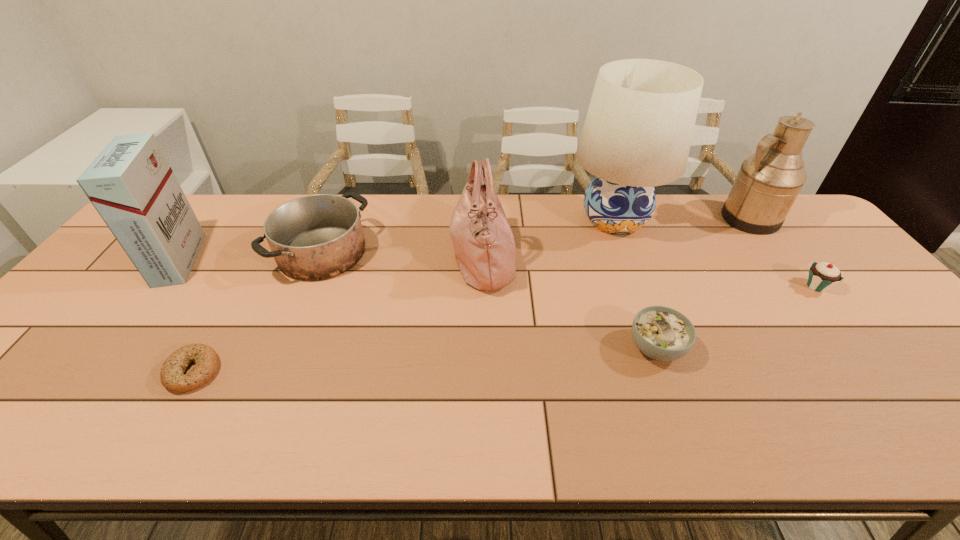
The width and height of the screenshot is (960, 540). I want to click on vacant space at the left edge of the desktop, so click(99, 304).

Where is `vacant space at the right edge of the desktop`? Image resolution: width=960 pixels, height=540 pixels. vacant space at the right edge of the desktop is located at coordinates (901, 340).

The image size is (960, 540). I want to click on free point between the pitcher and the soup bowl, so click(x=703, y=283).

Where is `empty space that is in between the fourth shortest object and the cupcake`? Image resolution: width=960 pixels, height=540 pixels. empty space that is in between the fourth shortest object and the cupcake is located at coordinates tap(569, 269).

At what (x,y) coordinates should I click in order to perform the action: click on unoccupied area between the shortest object and the pitcher. Please return your answer as a coordinate pair (x, y). The height and width of the screenshot is (540, 960). Looking at the image, I should click on (471, 295).

Image resolution: width=960 pixels, height=540 pixels. Identify the location of empty location between the cupcake and the pitcher. (782, 252).

Where is `vacant area that lies between the soup bowl and the leftmost object`? Image resolution: width=960 pixels, height=540 pixels. vacant area that lies between the soup bowl and the leftmost object is located at coordinates (418, 304).

Locate an element on the screen. vacant point located between the soup bowl and the cigarette case is located at coordinates (418, 304).

Find the location of `free spot between the lampshade and the pitcher`. free spot between the lampshade and the pitcher is located at coordinates (682, 220).

In order to click on free space between the pitcher and the lampshade in this screenshot , I will do `click(682, 220)`.